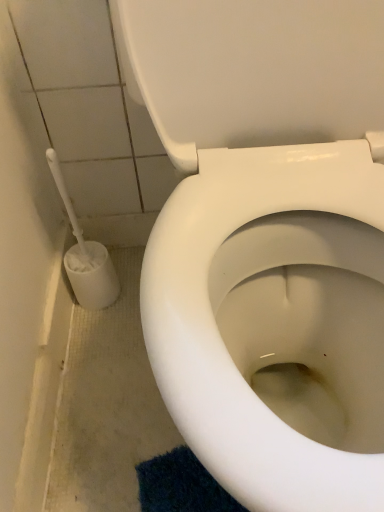
At what (x,y) coordinates should I click in order to perform the action: click on white plastic toilet brush at left. Please return your answer as a coordinate pair (x, y). Looking at the image, I should click on click(85, 256).

Describe the element at coordinates (85, 256) in the screenshot. Image resolution: width=384 pixels, height=512 pixels. I see `white plastic toilet brush at left` at that location.

Locate an element on the screen. This screenshot has width=384, height=512. white plastic toilet brush at left is located at coordinates (85, 256).